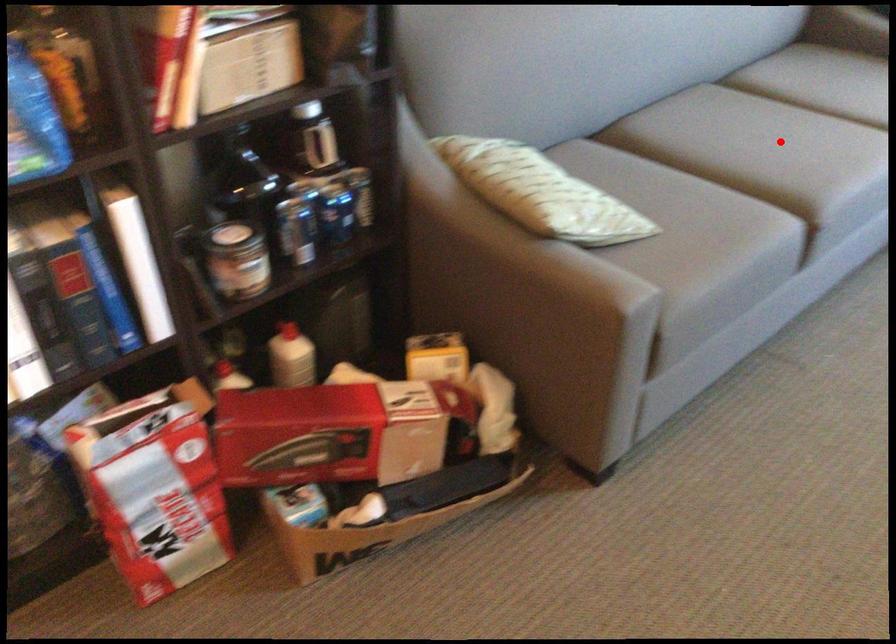
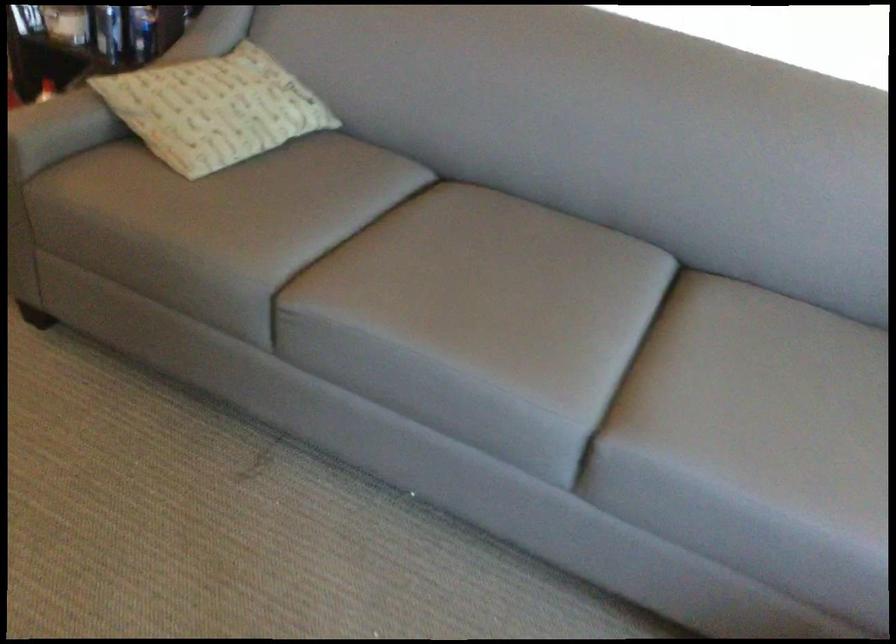
Where in the second image is the point corresponding to the highlighted location from the first image?

(479, 290)